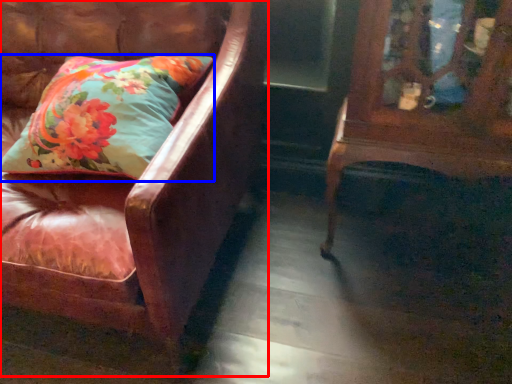
Question: Which object is further to the camera taking this photo, chair (highlighted by a red box) or pillow (highlighted by a blue box)?

Choices:
 (A) chair
 (B) pillow

Answer: (B)